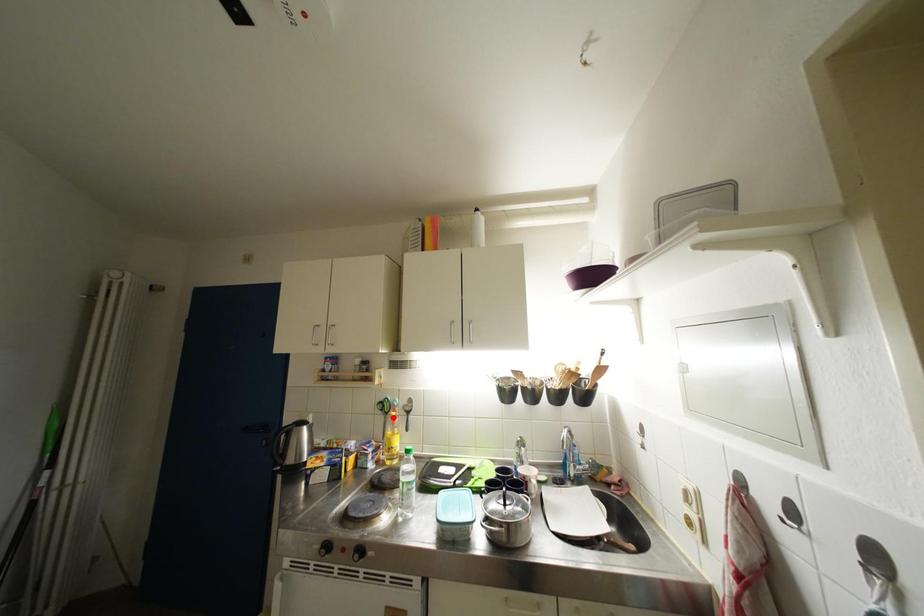
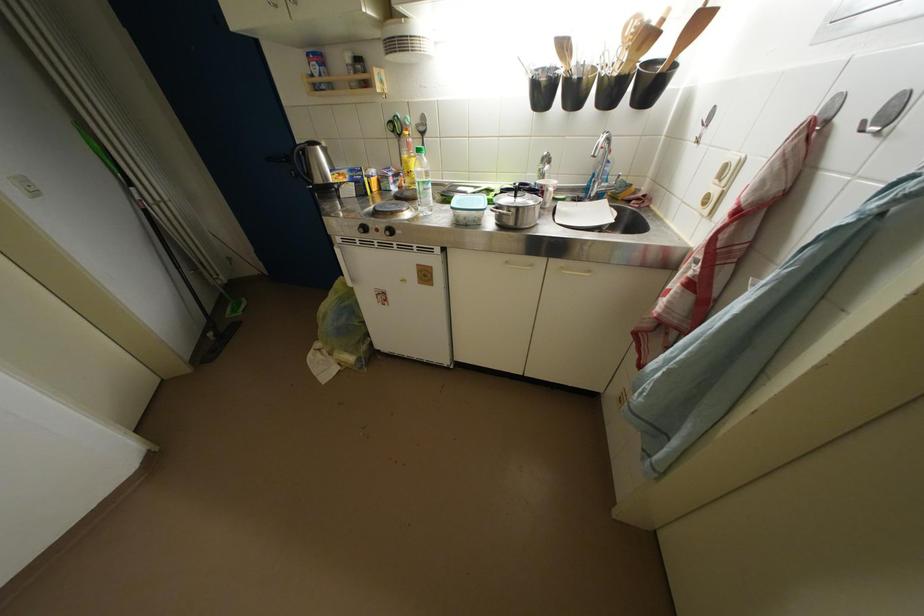
The point at the highlighted location is marked in the first image. Where is the corresponding point in the second image?

(407, 140)